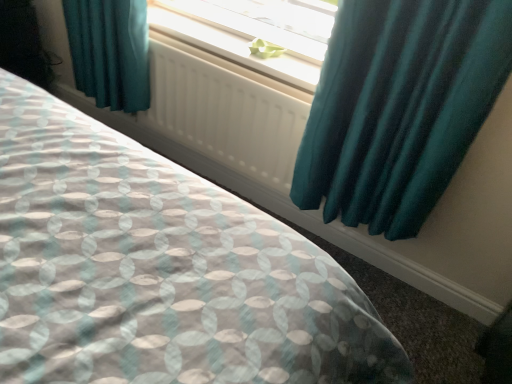
Image resolution: width=512 pixels, height=384 pixels. What do you see at coordinates (265, 49) in the screenshot?
I see `green paper at center` at bounding box center [265, 49].

Image resolution: width=512 pixels, height=384 pixels. I want to click on white matte radiator at center, so click(225, 112).

Measure the distance between white plastic radiator at upper center and camera.

They are 1.42 meters apart.

The height and width of the screenshot is (384, 512). What are the coordinates of `green paper at center` in the screenshot? It's located at (265, 49).

Does teal satin curtain at upper right have a greater width compared to white plastic radiator at upper center?

Yes, teal satin curtain at upper right is wider than white plastic radiator at upper center.

Considering the positions of objects teal satin curtain at upper right and white plastic radiator at upper center in the image provided, who is behind, teal satin curtain at upper right or white plastic radiator at upper center?

white plastic radiator at upper center is further away from the camera.

I want to click on curtain that appears on the right of white plastic radiator at upper center, so click(399, 108).

Looking at this image, is white plastic radiator at upper center located within teal satin curtain at upper right?

No, teal satin curtain at upper right does not contain white plastic radiator at upper center.

Is green paper at center directly adjacent to white matte radiator at center?

No, green paper at center is not beside white matte radiator at center.

Is green paper at center closer to the viewer compared to white matte radiator at center?

That is False.

Is green paper at center situated inside white matte radiator at center or outside?

green paper at center is outside white matte radiator at center.

Is teal satin curtain at upper right placed right next to white matte radiator at center?

There is a gap between teal satin curtain at upper right and white matte radiator at center.

Based on their sizes in the image, would you say teal satin curtain at upper right is bigger or smaller than white matte radiator at center?

In the image, teal satin curtain at upper right appears to be larger than white matte radiator at center.

Is teal satin curtain at upper right closer to the viewer compared to white matte radiator at center?

Yes, it is.

From a real-world perspective, is teal satin curtain at upper right physically located above or below white matte radiator at center?

Clearly, from a real-world perspective, teal satin curtain at upper right is above white matte radiator at center.

Does point (316, 52) appear closer or farther from the camera than point (256, 50)?

Point (316, 52) is closer to the camera than point (256, 50).

Which is more to the right, white plastic radiator at upper center or green paper at center?

Positioned to the right is green paper at center.

Considering the relative sizes of white plastic radiator at upper center and green paper at center in the image provided, is white plastic radiator at upper center taller than green paper at center?

Indeed, white plastic radiator at upper center has a greater height compared to green paper at center.

From the image's perspective, which one is positioned lower, white plastic radiator at upper center or green paper at center?

green paper at center is shown below in the image.

How different are the orientations of green paper at center and white plastic radiator at upper center in degrees?

They differ by 4.14 degrees in their facing directions.

Which point is more distant from viewer, (x=256, y=53) or (x=244, y=25)?

Positioned behind is point (x=244, y=25).

Is green paper at center at the left side of white plastic radiator at upper center?

In fact, green paper at center is to the right of white plastic radiator at upper center.

From a real-world perspective, does green paper at center sit lower than white plastic radiator at upper center?

No, from a real-world perspective, green paper at center is not under white plastic radiator at upper center.

From a real-world perspective, is white matte radiator at center physically located above or below white plastic radiator at upper center?

white matte radiator at center is situated lower than white plastic radiator at upper center in the real world.

Is white matte radiator at center looking in the opposite direction of white plastic radiator at upper center?

Yes, white matte radiator at center is facing away from white plastic radiator at upper center.

Considering the relative sizes of white matte radiator at center and white plastic radiator at upper center in the image provided, is white matte radiator at center shorter than white plastic radiator at upper center?

In fact, white matte radiator at center may be taller than white plastic radiator at upper center.

Between teal satin curtain at upper right and green paper at center, which one is positioned in front?

teal satin curtain at upper right is closer to the camera.

From a real-world perspective, is teal satin curtain at upper right on top of green paper at center?

Yes, from a real-world perspective, teal satin curtain at upper right is over green paper at center

Looking at this image, can you see teal satin curtain at upper right touching green paper at center?

They are not placed beside each other.

This screenshot has width=512, height=384. Find the location of `curtain above the white plastic radiator at upper center (from a real-world perspective)`. curtain above the white plastic radiator at upper center (from a real-world perspective) is located at coordinates (399, 108).

Find the location of a particular element. The image size is (512, 384). plant behind the white matte radiator at center is located at coordinates (265, 49).

From the image, which object appears to be farther from green paper at center, teal satin curtain at upper right or white plastic radiator at upper center?

The object further to green paper at center is teal satin curtain at upper right.

Estimate the real-world distances between objects in this image. Which object is further from teal satin curtain at upper right, white plastic radiator at upper center or white matte radiator at center?

white plastic radiator at upper center is positioned further to the anchor teal satin curtain at upper right.

Which object lies nearer to the anchor point green paper at center, white plastic radiator at upper center or teal satin curtain at upper right?

white plastic radiator at upper center lies closer to green paper at center than the other object.

From the image, which object appears to be nearer to teal satin curtain at upper right, white plastic radiator at upper center or green paper at center?

Based on the image, white plastic radiator at upper center appears to be nearer to teal satin curtain at upper right.

Looking at this image, looking at the image, which one is located further to white matte radiator at center, teal satin curtain at upper right or white plastic radiator at upper center?

The object further to white matte radiator at center is teal satin curtain at upper right.

Based on their spatial positions, is green paper at center or white matte radiator at center further from white plastic radiator at upper center?

white matte radiator at center.

Looking at the image, which one is located further to green paper at center, teal satin curtain at upper right or white matte radiator at center?

The object further to green paper at center is teal satin curtain at upper right.

When comparing their distances from teal satin curtain at upper right, does white matte radiator at center or white plastic radiator at upper center seem closer?

white matte radiator at center is positioned closer to the anchor teal satin curtain at upper right.

Find the location of a particular element. This screenshot has height=384, width=512. window positioned between teal satin curtain at upper right and green paper at center from near to far is located at coordinates (239, 39).

I want to click on plant between white plastic radiator at upper center and white matte radiator at center from top to bottom, so click(265, 49).

Find the location of a particular element. radiator positioned between teal satin curtain at upper right and green paper at center from near to far is located at coordinates (225, 112).

You are a GUI agent. You are given a task and a screenshot of the screen. Output one action in this format:
    pyautogui.click(x=<x>, y=<y>)
    Task: Click on the radiator located between teal satin curtain at upper right and white plastic radiator at upper center in the depth direction
    
    Given the screenshot: What is the action you would take?
    pyautogui.click(x=225, y=112)